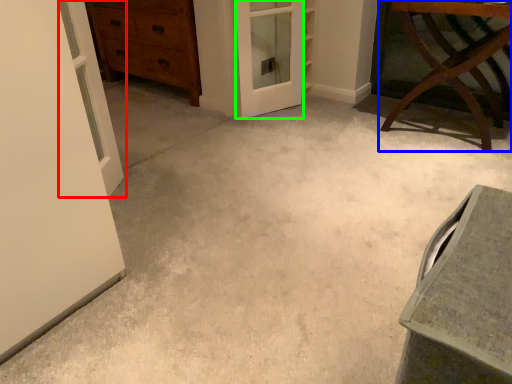
Question: Estimate the real-world distances between objects in this image. Which object is farther from door (highlighted by a red box), furniture (highlighted by a blue box) or screen door (highlighted by a green box)?

Choices:
 (A) furniture
 (B) screen door

Answer: (A)